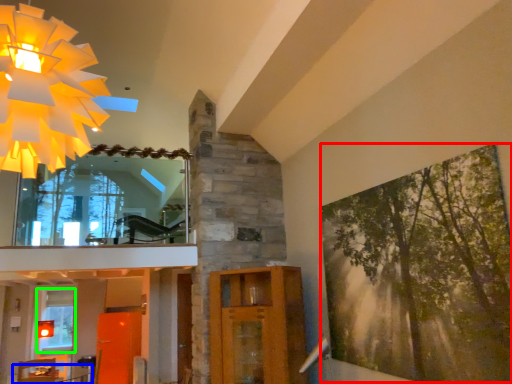
Question: Which is nearer to the tree (highlighted by a red box)? table (highlighted by a blue box) or window (highlighted by a green box).

Choices:
 (A) table
 (B) window

Answer: (B)